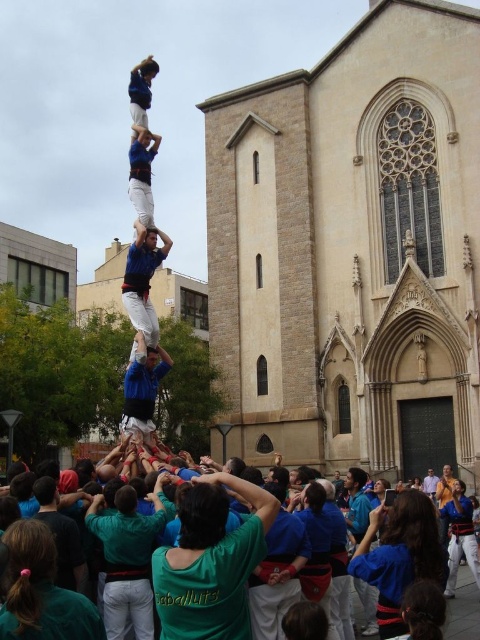
Question: Can you confirm if blue fabric shirt at center is smaller than blue fabric crowd at lower center?

Choices:
 (A) no
 (B) yes

Answer: (B)

Question: Is blue fabric man at center to the right of blue fabric crowd at lower center from the viewer's perspective?

Choices:
 (A) yes
 (B) no

Answer: (B)

Question: Which of the following is the farthest from the observer?

Choices:
 (A) (144, 412)
 (B) (286, 259)
 (C) (155, 228)
 (D) (458, 632)

Answer: (B)

Question: Among these points, which one is farthest from the camera?

Choices:
 (A) (133, 310)
 (B) (458, 595)
 (C) (124, 378)
 (D) (442, 432)

Answer: (C)

Question: Does beige stone church at center appear over blue fabric man at center?

Choices:
 (A) no
 (B) yes

Answer: (B)

Question: Which of the following is the closest to the observer?

Choices:
 (A) (477, 413)
 (B) (136, 326)
 (C) (428, 470)
 (D) (464, 609)

Answer: (D)